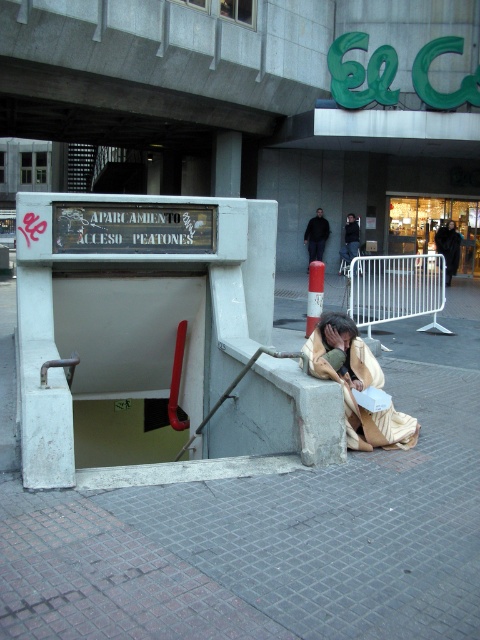
Does beige fabric blanket at lower center lie behind dark blue jeans at center?

No, beige fabric blanket at lower center is in front of dark blue jeans at center.

Find the location of a particular element. The height and width of the screenshot is (640, 480). beige fabric blanket at lower center is located at coordinates (357, 385).

Identify the location of beige fabric blanket at lower center. Image resolution: width=480 pixels, height=640 pixels. (357, 385).

The width and height of the screenshot is (480, 640). I want to click on beige fabric blanket at lower center, so [x=357, y=385].

Can you confirm if gray concrete curb at lower center is thinner than dark blue jeans at center?

No, gray concrete curb at lower center is not thinner than dark blue jeans at center.

Identify the location of gray concrete curb at lower center. The image size is (480, 640). (184, 470).

Is gray concrete curb at lower center above black fabric bag at lower right?

Actually, gray concrete curb at lower center is below black fabric bag at lower right.

How far apart are gray concrete curb at lower center and black fabric bag at lower right?

gray concrete curb at lower center is 16.64 meters from black fabric bag at lower right.

What do you see at coordinates (184, 470) in the screenshot? This screenshot has height=640, width=480. I see `gray concrete curb at lower center` at bounding box center [184, 470].

You are a GUI agent. You are given a task and a screenshot of the screen. Output one action in this format:
    pyautogui.click(x=<x>, y=<y>)
    Task: Click on the gray concrete curb at lower center
    The height and width of the screenshot is (640, 480).
    Given the screenshot: What is the action you would take?
    pyautogui.click(x=184, y=470)